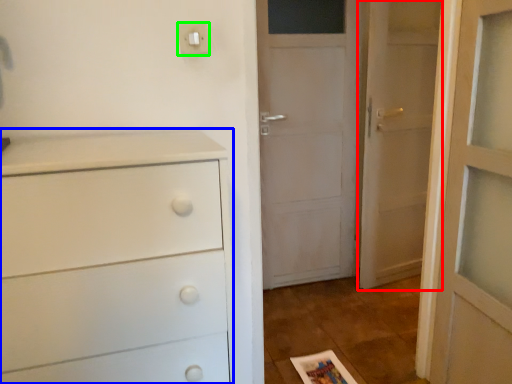
Question: Which object is the farthest from door (highlighted by a red box)? Choose among these: chest of drawers (highlighted by a blue box) or light switch (highlighted by a green box).

Choices:
 (A) chest of drawers
 (B) light switch

Answer: (A)